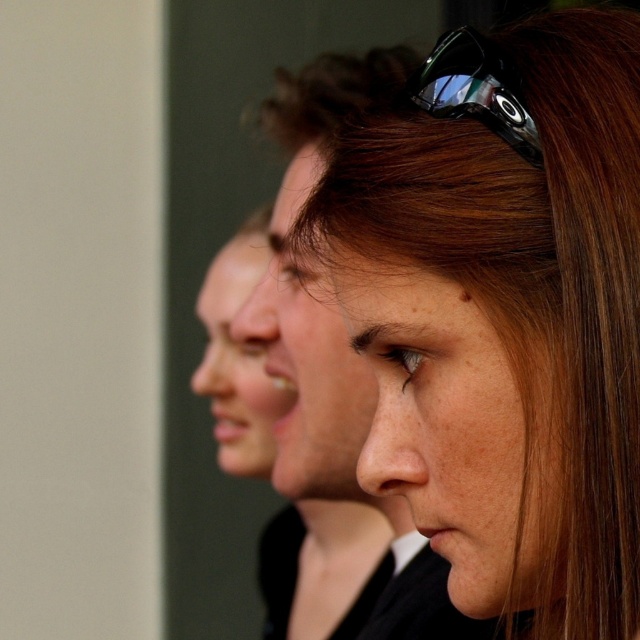
Can you confirm if brown hair at center is wider than black plastic sunglasses at upper center?

Yes, brown hair at center is wider than black plastic sunglasses at upper center.

Can you confirm if brown hair at center is taller than black plastic sunglasses at upper center?

Indeed, brown hair at center has a greater height compared to black plastic sunglasses at upper center.

Locate an element on the screen. brown hair at center is located at coordinates (506, 323).